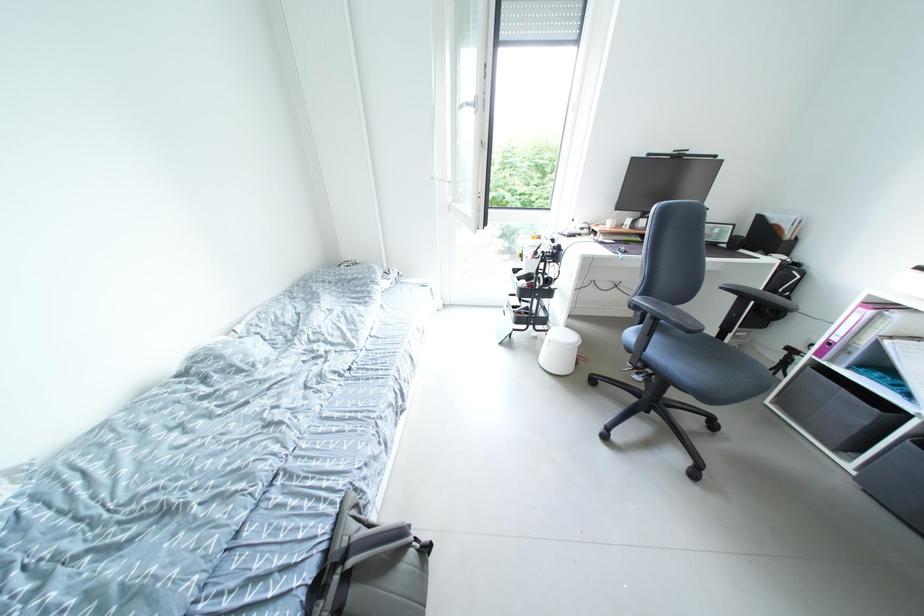
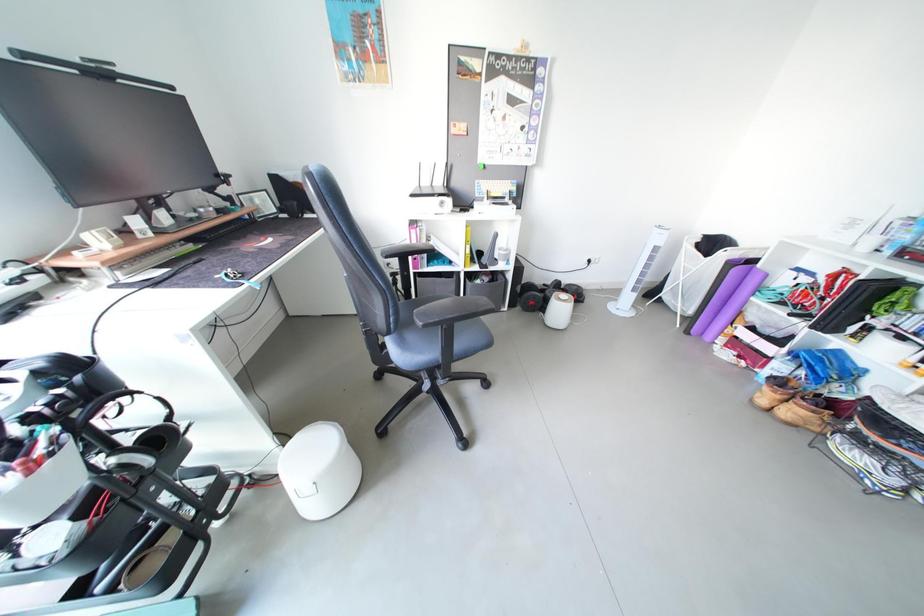
First-person continuous shooting, in which direction is the camera rotating?

The rotation direction of the camera is right-down.